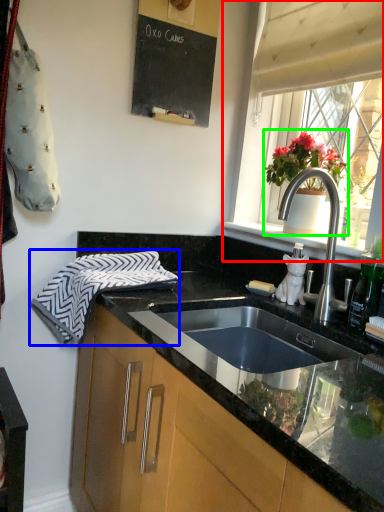
Question: Based on their relative distances, which object is farther from window (highlighted by a red box)? Choose from hand towel (highlighted by a blue box) and houseplant (highlighted by a green box).

Choices:
 (A) hand towel
 (B) houseplant

Answer: (A)